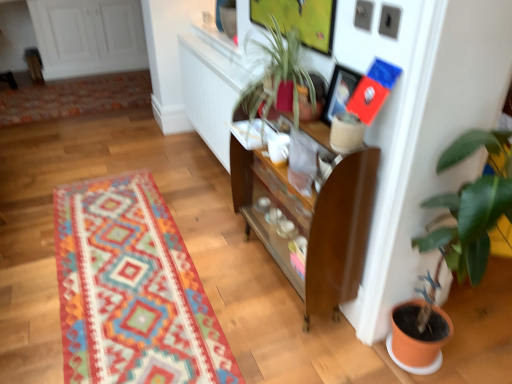
Identify the location of free area below multicolored woven rug at center, positioned as the 1th mat in bottom-to-top order (from a real-world perspective). This screenshot has height=384, width=512. (134, 266).